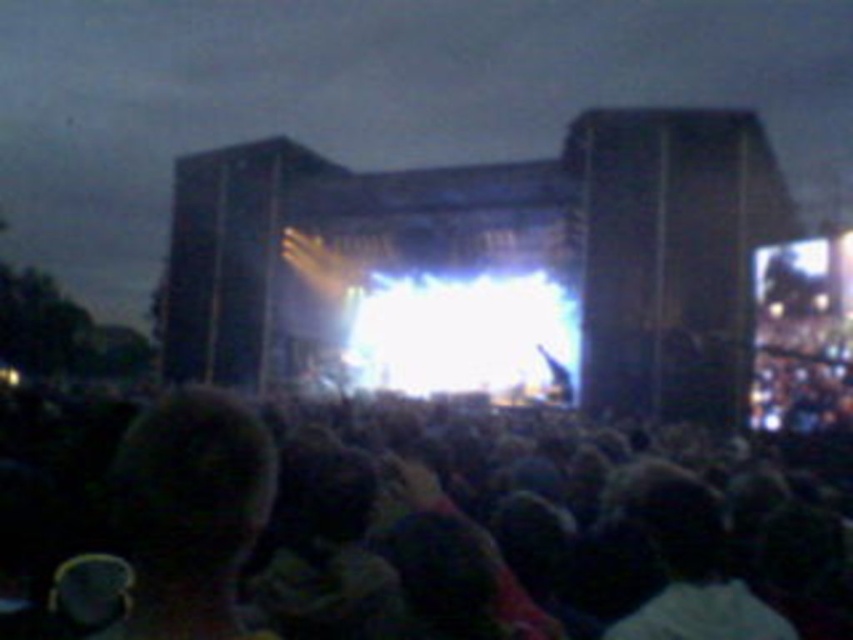
Does dark matte crowd at center appear on the right side of dark hair at lower left?

Indeed, dark matte crowd at center is positioned on the right side of dark hair at lower left.

Where is `dark matte crowd at center`? The width and height of the screenshot is (853, 640). dark matte crowd at center is located at coordinates (407, 532).